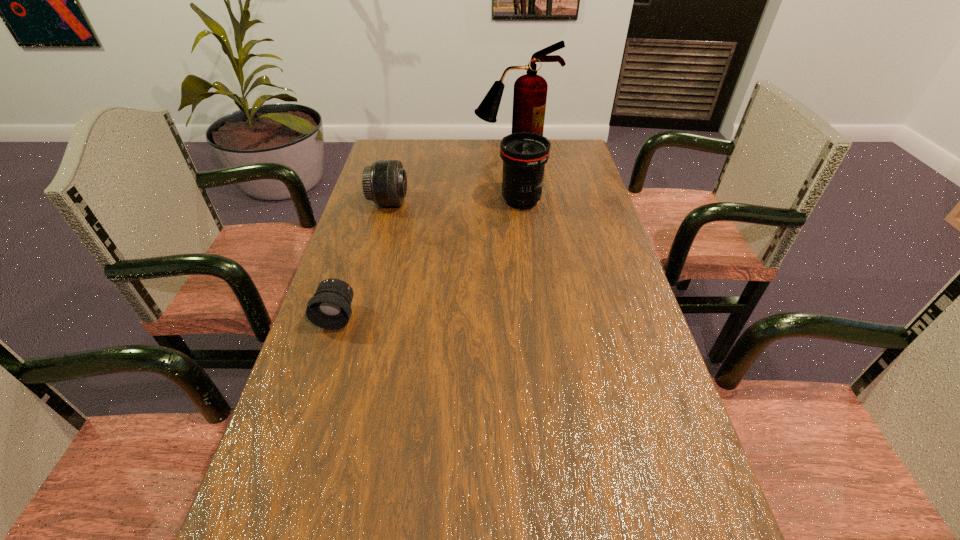
Identify the location of vacant space that satisfies the following two spatial constraints: 1. at the nozzle of the farthest object; 2. on the front-facing side of the third tallest object. (521, 202).

At what (x,y) coordinates should I click in order to perform the action: click on free space that satisfies the following two spatial constraints: 1. on the front-facing side of the third tallest object; 2. at the front element of the nearest telephoto lens. Please return your answer as a coordinate pair (x, y). The width and height of the screenshot is (960, 540). Looking at the image, I should click on (358, 316).